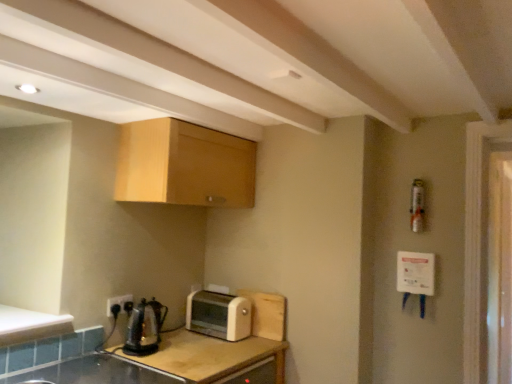
At what (x,y) coordinates should I click in order to perform the action: click on wooden at lower left. Please return your answer as a coordinate pair (x, y). Looking at the image, I should click on (160, 363).

What do you see at coordinates (499, 268) in the screenshot? The height and width of the screenshot is (384, 512). I see `transparent glass screen door at right` at bounding box center [499, 268].

Looking at this image, in order to face beige plastic toaster at center, should I rotate leftwards or rightwards?

Turn left by 5.077 degrees to look at beige plastic toaster at center.

Locate an element on the screen. The height and width of the screenshot is (384, 512). white matte counter top at lower left is located at coordinates (30, 325).

From the picture: Does black plastic electric outlet at lower left touch white matte counter top at lower left?

They are not placed beside each other.

From the image's perspective, which one is positioned higher, black plastic electric outlet at lower left or white matte counter top at lower left?

white matte counter top at lower left.

Where is `electric outlet on the right of white matte counter top at lower left`? This screenshot has height=384, width=512. electric outlet on the right of white matte counter top at lower left is located at coordinates click(x=118, y=302).

Between point (108, 300) and point (72, 327), which one is positioned in front?

The point (72, 327) is closer to the camera.

Can we say beige plastic toaster at center lies outside white matte counter top at lower left?

beige plastic toaster at center is positioned outside white matte counter top at lower left.

Considering the positions of objects beige plastic toaster at center and white matte counter top at lower left in the image provided, who is in front, beige plastic toaster at center or white matte counter top at lower left?

white matte counter top at lower left.

Which is more to the right, beige plastic toaster at center or white matte counter top at lower left?

Positioned to the right is beige plastic toaster at center.

From a real-world perspective, is white matte counter top at lower left physically located above or below wooden at lower left?

white matte counter top at lower left is above wooden at lower left.

Based on the photo, can you tell me how much white matte counter top at lower left and wooden at lower left differ in facing direction?

white matte counter top at lower left and wooden at lower left are facing 0.616 degrees away from each other.

Considering the relative sizes of white matte counter top at lower left and wooden at lower left in the image provided, is white matte counter top at lower left bigger than wooden at lower left?

No.

Could you tell me if white matte counter top at lower left is turned towards wooden at lower left?

No.

Considering the positions of point (223, 328) and point (121, 299), is point (223, 328) closer or farther from the camera than point (121, 299)?

Clearly, point (223, 328) is more distant from the camera than point (121, 299).

Which is more to the right, beige plastic toaster at center or black plastic electric outlet at lower left?

Positioned to the right is beige plastic toaster at center.

Which object is more forward, beige plastic toaster at center or black plastic electric outlet at lower left?

black plastic electric outlet at lower left is closer to the camera.

Which of these two, wooden at lower left or white matte counter top at lower left, is thinner?

white matte counter top at lower left.

Based on the photo, is wooden at lower left to the left of white matte counter top at lower left from the viewer's perspective?

No, wooden at lower left is not to the left of white matte counter top at lower left.

Does point (178, 370) come in front of point (53, 316)?

Yes, point (178, 370) is in front of point (53, 316).

Is wooden at lower left completely or partially outside of white matte counter top at lower left?

Indeed, wooden at lower left is completely outside white matte counter top at lower left.

Based on the photo, from a real-world perspective, is light wood cabinet at upper center above or below white matte counter top at lower left?

From a real-world perspective, light wood cabinet at upper center is physically above white matte counter top at lower left.

Is light wood cabinet at upper center facing towards white matte counter top at lower left?

No, light wood cabinet at upper center is not aimed at white matte counter top at lower left.

How distant is light wood cabinet at upper center from white matte counter top at lower left?

A distance of 33.92 inches exists between light wood cabinet at upper center and white matte counter top at lower left.

How different are the orientations of wooden at lower left and beige plastic toaster at center in degrees?

The angle between the facing direction of wooden at lower left and the facing direction of beige plastic toaster at center is 1.65 degrees.

Would you consider wooden at lower left to be distant from beige plastic toaster at center?

Actually, wooden at lower left and beige plastic toaster at center are a little close together.

Is wooden at lower left shorter than beige plastic toaster at center?

No.

In the scene shown: How much distance is there between wooden at lower left and beige plastic toaster at center?

wooden at lower left and beige plastic toaster at center are 12.42 inches apart.

You are a GUI agent. You are given a task and a screenshot of the screen. Output one action in this format:
    pyautogui.click(x=<x>, y=<y>)
    Task: Click on the electric outlet that appears on the right of white matte counter top at lower left
    The width and height of the screenshot is (512, 384).
    Given the screenshot: What is the action you would take?
    pyautogui.click(x=118, y=302)

The image size is (512, 384). I want to click on counter top that appears in front of the beige plastic toaster at center, so click(30, 325).

When comparing their distances from white matte counter top at lower left, does shiny metallic kettle at lower left or beige plastic toaster at center seem closer?

shiny metallic kettle at lower left is closer to white matte counter top at lower left.

From the image, which object appears to be farther from transparent glass screen door at right, black plastic electric outlet at lower left or beige plastic toaster at center?

black plastic electric outlet at lower left.

Considering their positions, is black plastic electric outlet at lower left positioned further to shiny metallic kettle at lower left than wooden at lower left?

wooden at lower left is positioned further to the anchor shiny metallic kettle at lower left.

From the image, which object appears to be nearer to shiny metallic kettle at lower left, black plastic electric outlet at lower left or beige plastic toaster at center?

black plastic electric outlet at lower left.

Looking at the image, which one is located further to wooden at lower left, black plastic electric outlet at lower left or light wood cabinet at upper center?

Among the two, light wood cabinet at upper center is located further to wooden at lower left.

Estimate the real-world distances between objects in this image. Which object is closer to light wood cabinet at upper center, white matte counter top at lower left or wooden at lower left?

The object closer to light wood cabinet at upper center is white matte counter top at lower left.

Which object lies nearer to the anchor point beige plastic toaster at center, black plastic electric outlet at lower left or shiny metallic kettle at lower left?

The object closer to beige plastic toaster at center is shiny metallic kettle at lower left.

Considering their positions, is white matte counter top at lower left positioned further to wooden at lower left than shiny metallic kettle at lower left?

white matte counter top at lower left is positioned further to the anchor wooden at lower left.

The height and width of the screenshot is (384, 512). In order to click on tea pot between white matte counter top at lower left and wooden at lower left from left to right in this screenshot , I will do `click(144, 328)`.

This screenshot has height=384, width=512. In order to click on cabinetry between black plastic electric outlet at lower left and transparent glass screen door at right from left to right in this screenshot , I will do `click(184, 165)`.

Identify the location of toaster between black plastic electric outlet at lower left and transparent glass screen door at right in the horizontal direction. Image resolution: width=512 pixels, height=384 pixels. (219, 315).

This screenshot has height=384, width=512. I want to click on toaster between white matte counter top at lower left and transparent glass screen door at right, so click(219, 315).